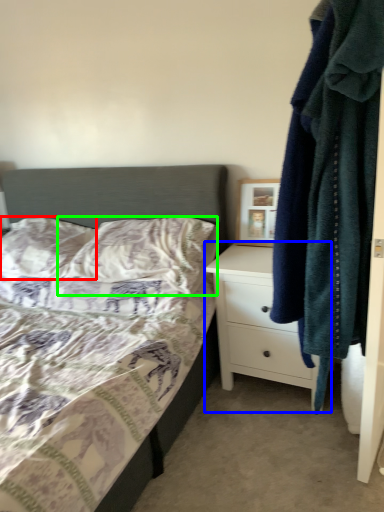
Question: Estimate the real-world distances between objects in this image. Which object is farther from pillow (highlighted by a red box), chest of drawers (highlighted by a blue box) or pillow (highlighted by a green box)?

Choices:
 (A) chest of drawers
 (B) pillow

Answer: (A)